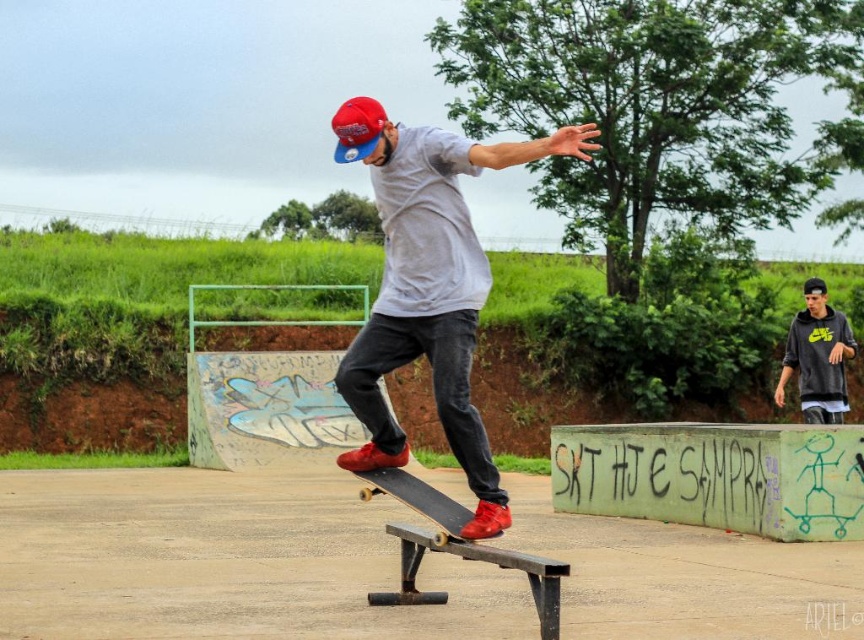
You are a photographer trying to capture the skateboarder in the skatepark. You need to focus your camera on the matte red sneakers at center. What are the exact coordinates where you should aim your camera?

The exact coordinates to aim your camera at the matte red sneakers at center are point (x=429, y=285).

Looking at this image, you are a photographer at the skatepark and want to capture a photo of the black matte skateboard at center and the matte red sneakers at center. Based on their positions, which object is closer to the left side of the frame?

The matte red sneakers at center are to the left of the black matte skateboard at center, so they are closer to the left side of the frame.

You are a photographer positioned at the dark gray hoodie at right. You want to take a photo of the black matte skateboard at center. Can you estimate how far you need to walk to reach the skateboard?

The distance between the dark gray hoodie at right and the black matte skateboard at center is 9.90 meters. Therefore, you need to walk approximately 9.90 meters to reach the skateboard.